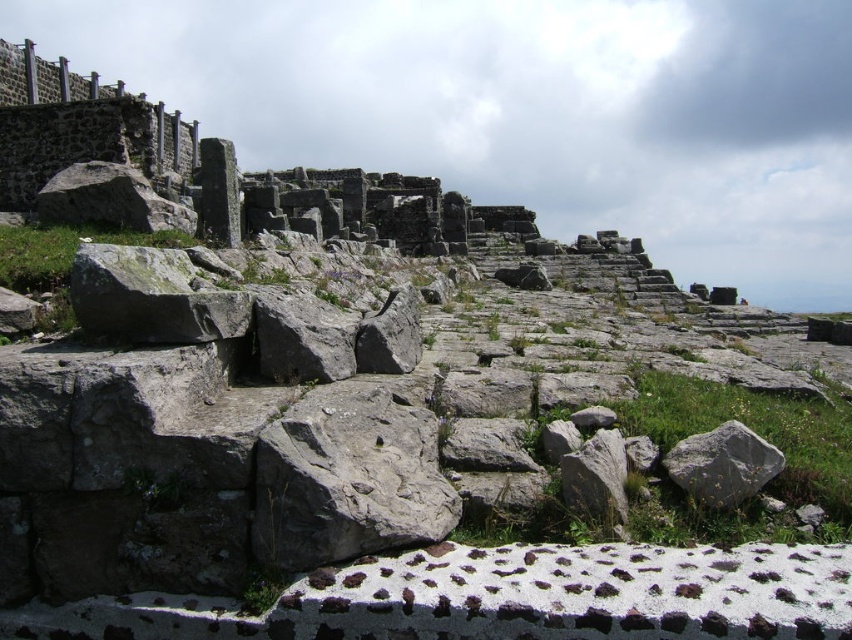
You are an archaeologist examining the ancient stone structure. You notice two objects at the center of the scene. Which one is located higher up, the gray rough stone at center or the gray rough rock at center?

The gray rough stone at center is positioned over the gray rough rock at center, so it is higher up.

You are an archaeologist examining the ancient stone structure. You notice two objects labeled gray rough stone at center and gray rough rock at center. Which one is closer to you based on their positions?

The gray rough stone at center is closer to you because it is in front of the gray rough rock at center.